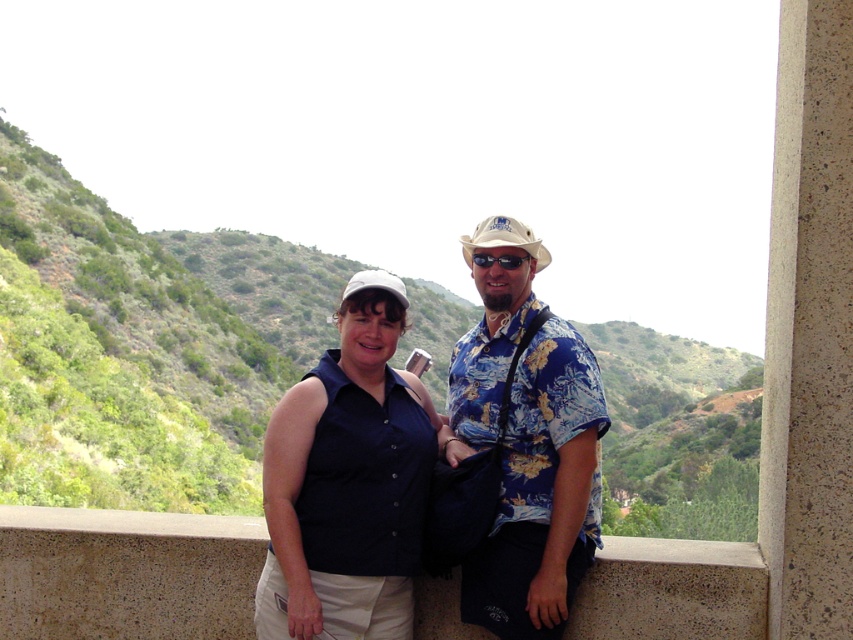
Based on the scene description, where is the green leafy hillside at upper left located in terms of its 2D coordinates?

The green leafy hillside at upper left is located at the 2D coordinates of point (141, 346).

You are a photographer positioned at the scene. You want to capture a photo where the green leafy hillside at upper left and the floral print shirt at center are both visible. Which object should be placed closer to the camera to ensure both are in focus?

The green leafy hillside at upper left is further to the viewer than the floral print shirt at center, so to ensure both are in focus, the photographer should place the floral print shirt at center closer to the camera.